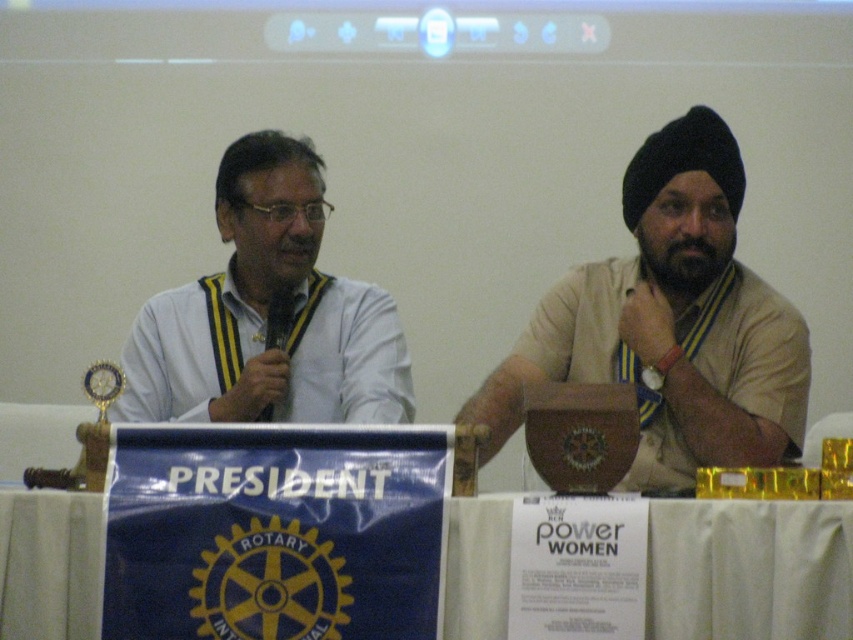
Is beige fabric shirt at right above white matte shirt at left?

Incorrect, beige fabric shirt at right is not positioned above white matte shirt at left.

Based on the photo, does beige fabric shirt at right appear on the right side of white matte shirt at left?

Indeed, beige fabric shirt at right is positioned on the right side of white matte shirt at left.

Where is `beige fabric shirt at right`? This screenshot has height=640, width=853. beige fabric shirt at right is located at coordinates (671, 323).

Is beige fabric shirt at right positioned in front of white cloth at lower center?

No, it is not.

Who is positioned more to the left, beige fabric shirt at right or white cloth at lower center?

From the viewer's perspective, beige fabric shirt at right appears more on the left side.

I want to click on beige fabric shirt at right, so click(x=671, y=323).

Does white cloth at lower center have a lesser height compared to white matte shirt at left?

Yes, white cloth at lower center is shorter than white matte shirt at left.

Who is higher up, white cloth at lower center or white matte shirt at left?

Positioned higher is white matte shirt at left.

The image size is (853, 640). In order to click on white cloth at lower center in this screenshot , I will do `click(749, 570)`.